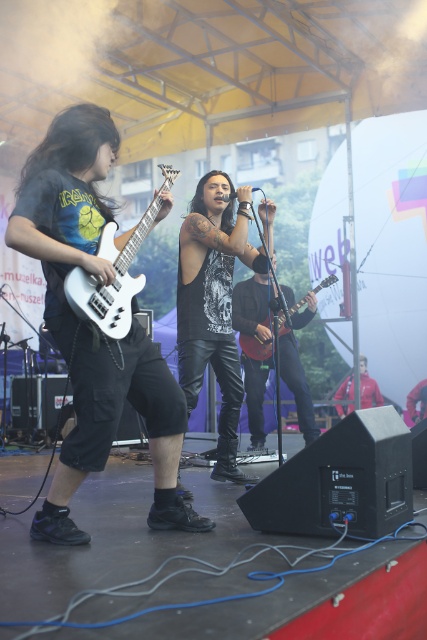
Question: Does matte black guitar at left have a greater width compared to matte red electric guitar at center?

Choices:
 (A) yes
 (B) no

Answer: (A)

Question: Does black leather guitar at center appear under dark gray leather jacket at center?

Choices:
 (A) yes
 (B) no

Answer: (B)

Question: Among these objects, which one is nearest to the camera?

Choices:
 (A) black leather pants at center
 (B) matte black guitar at left
 (C) matte red electric guitar at center
 (D) white matte electric guitar at left

Answer: (B)

Question: Does black leather guitar at center appear under white matte electric guitar at left?

Choices:
 (A) yes
 (B) no

Answer: (A)

Question: Which object is closer to the camera taking this photo?

Choices:
 (A) matte red electric guitar at center
 (B) white matte electric guitar at left
 (C) black leather guitar at center

Answer: (B)

Question: Which point is closer to the camera taking this photo?

Choices:
 (A) (123, 310)
 (B) (248, 337)

Answer: (A)